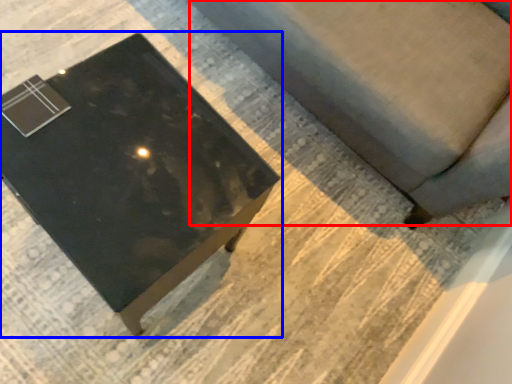
Question: Among these objects, which one is farthest to the camera, couch (highlighted by a red box) or table (highlighted by a blue box)?

Choices:
 (A) couch
 (B) table

Answer: (B)